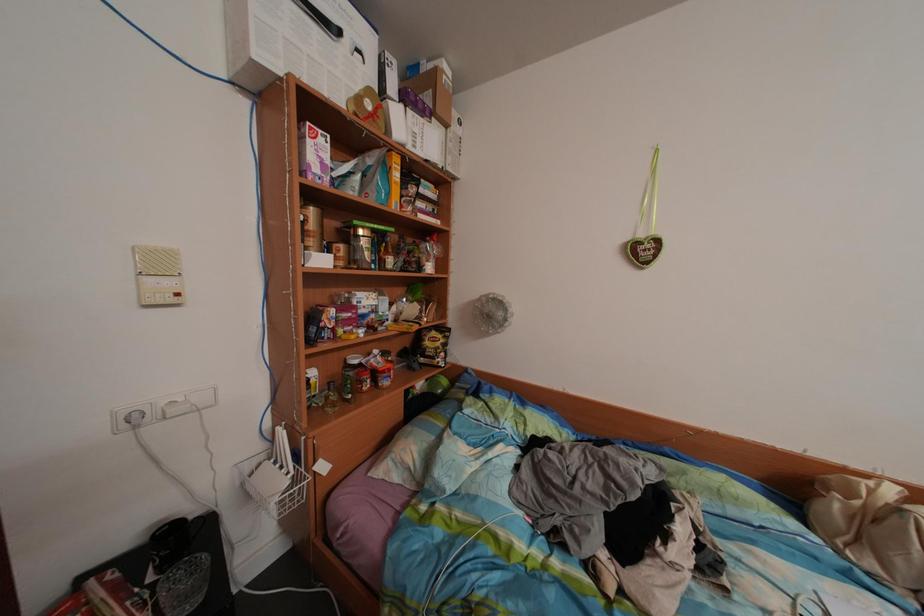
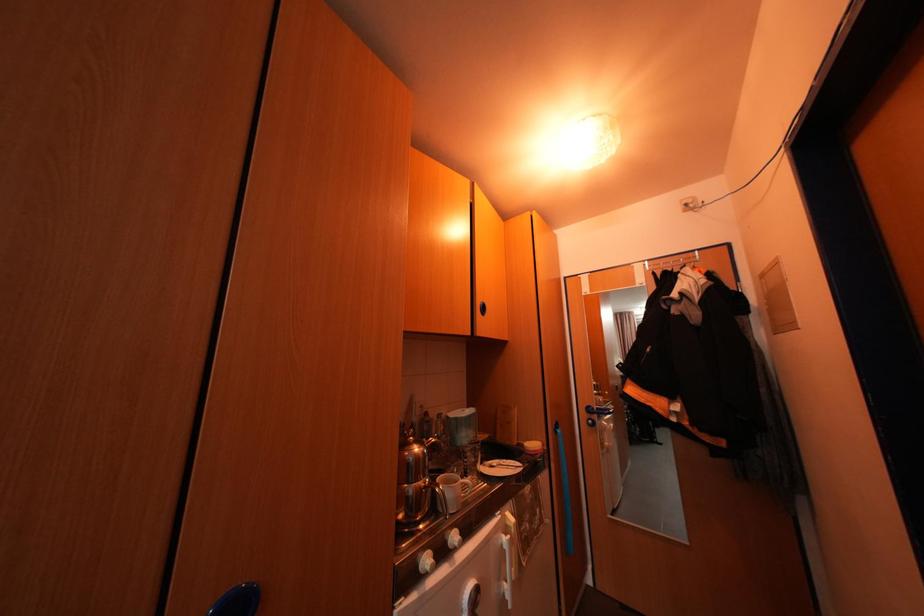
Question: The camera is either moving clockwise (left) or counter-clockwise (right) around the object. The first image is from the beginning of the video and the second image is from the end. Is the camera moving left or right when shooting the video?

Choices:
 (A) Left
 (B) Right

Answer: (B)